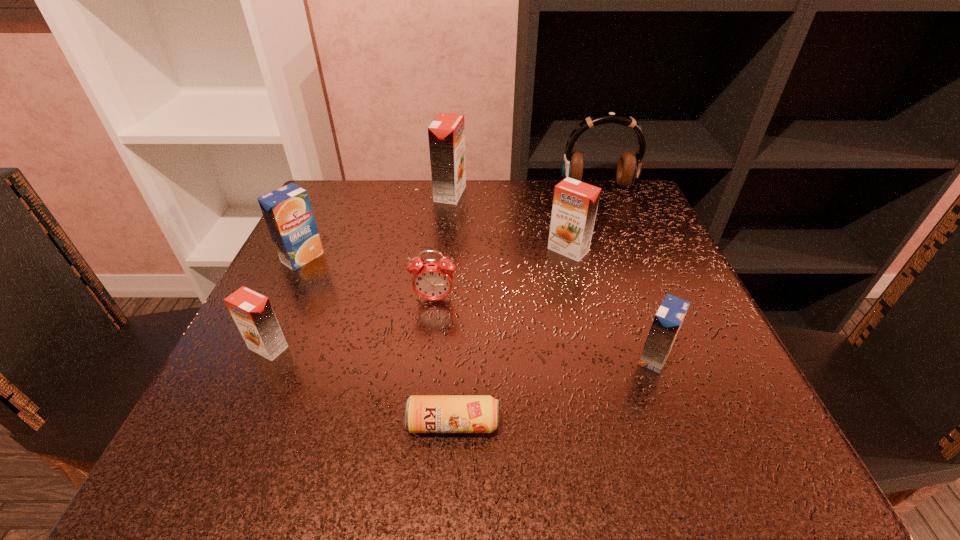
The height and width of the screenshot is (540, 960). I want to click on headset, so click(629, 166).

Where is `the farthest orange orange juice`? the farthest orange orange juice is located at coordinates (446, 133).

Where is `the farthest orange juice`? the farthest orange juice is located at coordinates (446, 133).

Find the location of a particular element. the second farthest orange orange juice is located at coordinates (575, 203).

Identify the location of the fourth orange juice from left to right. This screenshot has height=540, width=960. (575, 203).

Where is `the bigger blue orange_juice`? The width and height of the screenshot is (960, 540). the bigger blue orange_juice is located at coordinates (287, 211).

The image size is (960, 540). What are the coordinates of `the left blue orange_juice` in the screenshot? It's located at (287, 211).

Find the location of a particular element. the fifth farthest object is located at coordinates (432, 280).

Identify the location of alarm clock. The width and height of the screenshot is (960, 540). (432, 280).

Image resolution: width=960 pixels, height=540 pixels. I want to click on the right blue orange_juice, so click(667, 322).